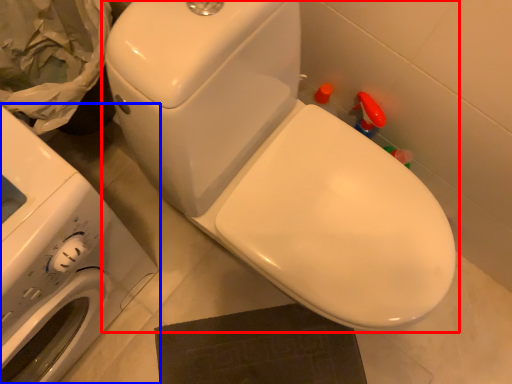
Question: Which point is further to the camera, toilet (highlighted by a red box) or washing machine (highlighted by a blue box)?

Choices:
 (A) toilet
 (B) washing machine

Answer: (A)